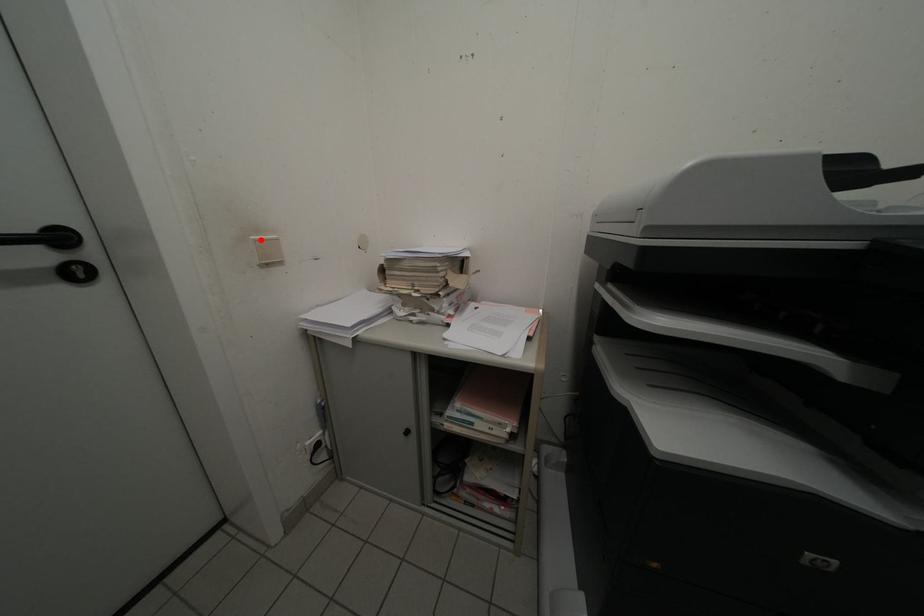
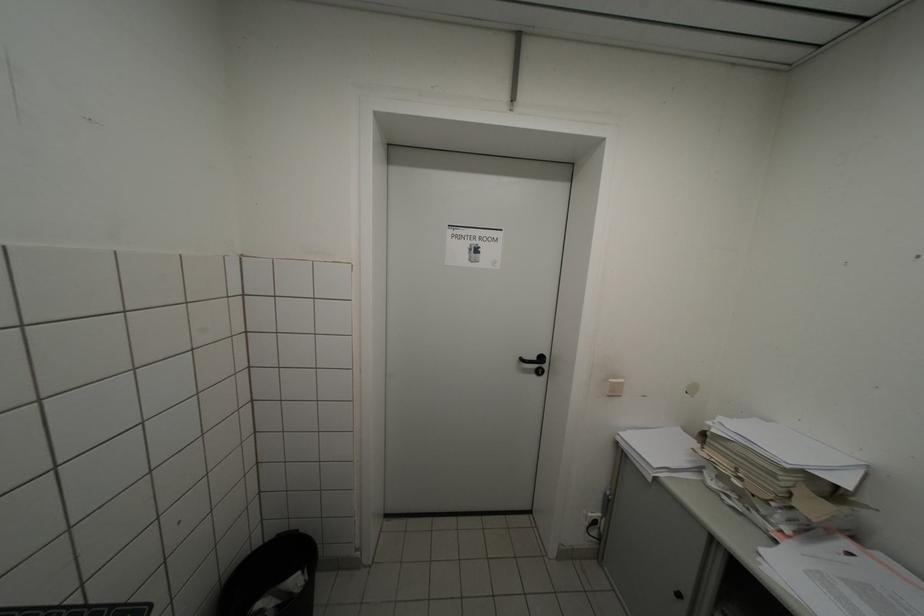
The point at the highlighted location is marked in the first image. Where is the corresponding point in the second image?

(618, 383)